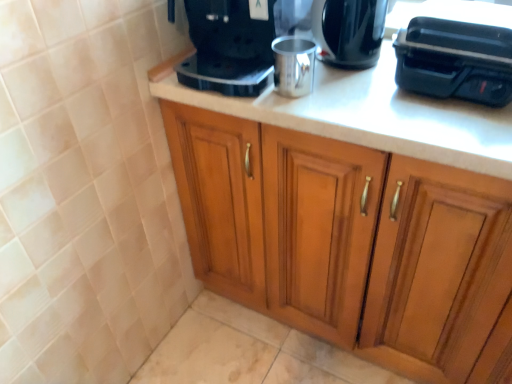
Question: Is wooden cabinet at center inside or outside of black plastic toaster at upper right, the 2th appliance positioned from the left?

Choices:
 (A) inside
 (B) outside

Answer: (B)

Question: In terms of size, does wooden cabinet at center appear bigger or smaller than black plastic toaster at upper right, the 2th appliance positioned from the left?

Choices:
 (A) small
 (B) big

Answer: (B)

Question: Which object is positioned closest to the shiny black coffee maker at upper center?

Choices:
 (A) black plastic toaster at upper right, acting as the 1th appliance starting from the right
 (B) wooden cabinet at center
 (C) silver metallic cup at center, the first appliance from the left
 (D) satin black coffee maker at upper center

Answer: (C)

Question: Considering the real-world distances, which object is closest to the black plastic toaster at upper right, the 2th appliance positioned from the left?

Choices:
 (A) silver metallic cup at center, the first appliance from the left
 (B) wooden cabinet at center
 (C) shiny black coffee maker at upper center
 (D) satin black coffee maker at upper center

Answer: (C)